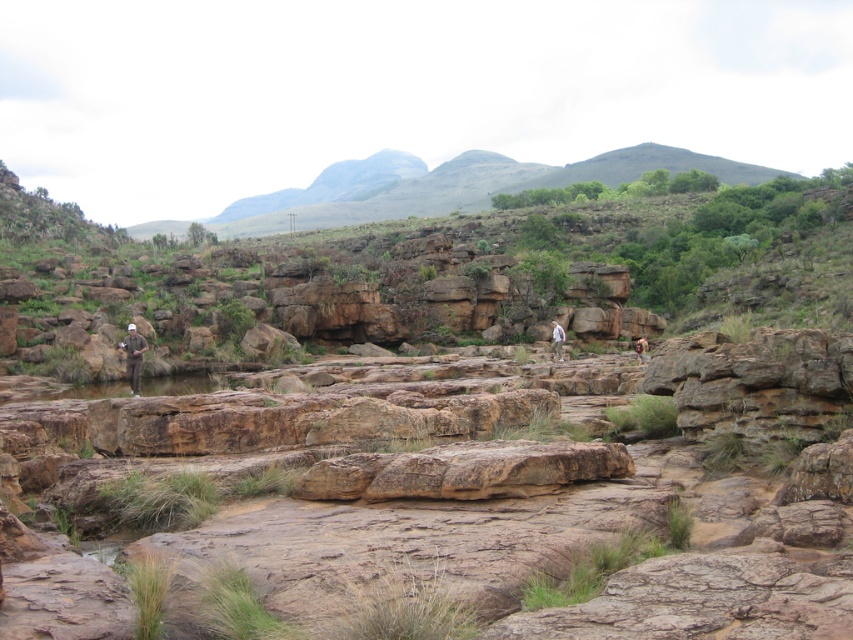
You are a hiker trying to navigate through the rocky terrain. You see the green grassy hill at upper center and the camouflage fabric hat at left. Which object is positioned to the right of the other?

The green grassy hill at upper center is to the right of the camouflage fabric hat at left.